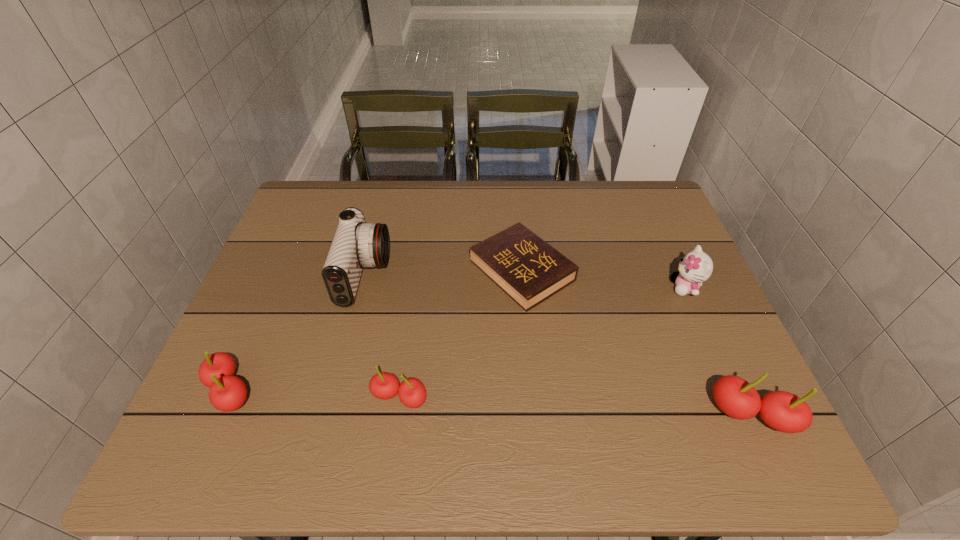
If we want them evenly spaced by inserting an extra cherry among them, please locate a free spot for this new cherry. Please provide its 2D coordinates. Your answer should be formatted as a tuple, i.e. [(x, y)], where the tuple contains the x and y coordinates of a point satisfying the conditions above.

[(573, 406)]